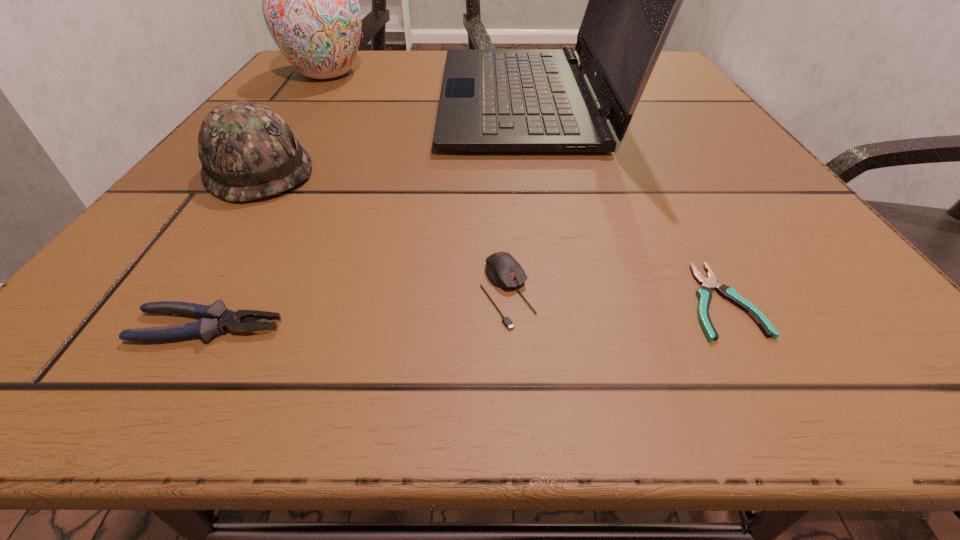
In the image, there is a desktop. Where is `vacant space at the near right corner`? Image resolution: width=960 pixels, height=540 pixels. vacant space at the near right corner is located at coordinates (830, 373).

Where is `empty location between the tallest object and the third shortest object`? empty location between the tallest object and the third shortest object is located at coordinates (519, 195).

In order to click on vacant space that's between the shortest object and the taller pliers in this screenshot , I will do `click(465, 314)`.

Where is `vacant space that is in between the tallest object and the mouse`? vacant space that is in between the tallest object and the mouse is located at coordinates (519, 195).

Locate an element on the screen. free point between the fifth shortest object and the shortest object is located at coordinates (524, 187).

Where is `vacant region between the fifth tallest object and the fourth shortest object`? vacant region between the fifth tallest object and the fourth shortest object is located at coordinates (233, 248).

The height and width of the screenshot is (540, 960). I want to click on blank region between the third tallest object and the right pliers, so click(x=490, y=235).

At what (x,y) coordinates should I click in order to perform the action: click on vacant area between the fourth shortest object and the right pliers. Please return your answer as a coordinate pair (x, y). The image size is (960, 540). Looking at the image, I should click on (490, 235).

Where is `empty location between the headwear and the tallest object`? empty location between the headwear and the tallest object is located at coordinates (396, 135).

Find the location of a particular element. free space that is in between the laptop computer and the headwear is located at coordinates (396, 135).